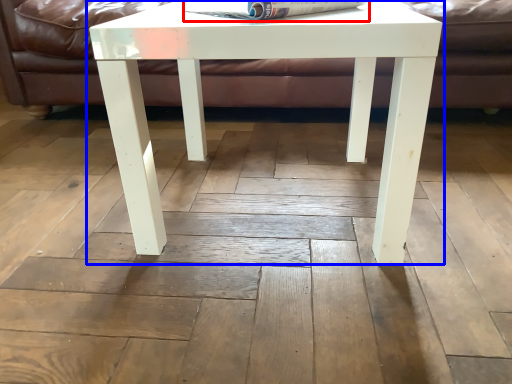
Question: Which point is further to the camera, magazine (highlighted by a red box) or table (highlighted by a blue box)?

Choices:
 (A) magazine
 (B) table

Answer: (A)